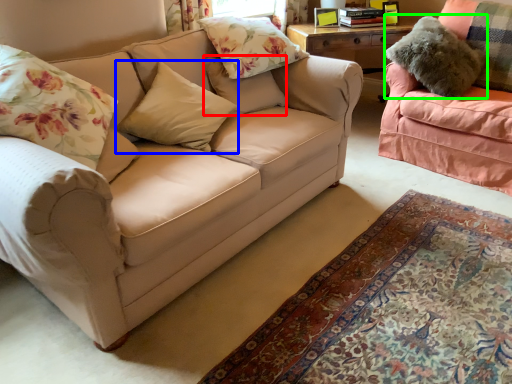
Question: Which object is positioned closest to pillow (highlighted by a red box)? Select from pillow (highlighted by a blue box) and pillow (highlighted by a green box).

Choices:
 (A) pillow
 (B) pillow

Answer: (A)